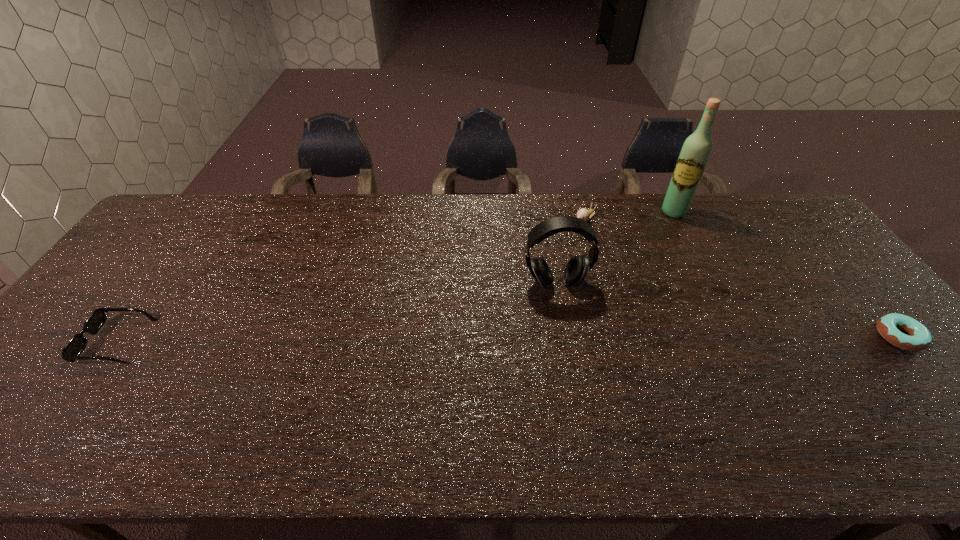
The width and height of the screenshot is (960, 540). In order to click on escargot present at the far edge in this screenshot , I will do `click(584, 214)`.

Where is `wine bottle that is at the far edge`? Image resolution: width=960 pixels, height=540 pixels. wine bottle that is at the far edge is located at coordinates (694, 155).

The width and height of the screenshot is (960, 540). Find the location of `object that is at the left edge`. object that is at the left edge is located at coordinates click(71, 352).

This screenshot has width=960, height=540. I want to click on object located in the right edge section of the desktop, so click(920, 338).

This screenshot has width=960, height=540. In the image, there is a desktop. Identify the location of vacant space at the far edge. (604, 211).

I want to click on vacant space at the near edge of the desktop, so click(712, 392).

Where is `vacant space at the left edge of the desktop`? This screenshot has width=960, height=540. vacant space at the left edge of the desktop is located at coordinates (69, 338).

Find the location of a particular element. Image resolution: width=960 pixels, height=540 pixels. free space at the right edge of the desktop is located at coordinates (896, 376).

I want to click on vacant space at the far left corner of the desktop, so (x=225, y=195).

The width and height of the screenshot is (960, 540). Identify the location of free region at the near left corner of the desktop. (76, 406).